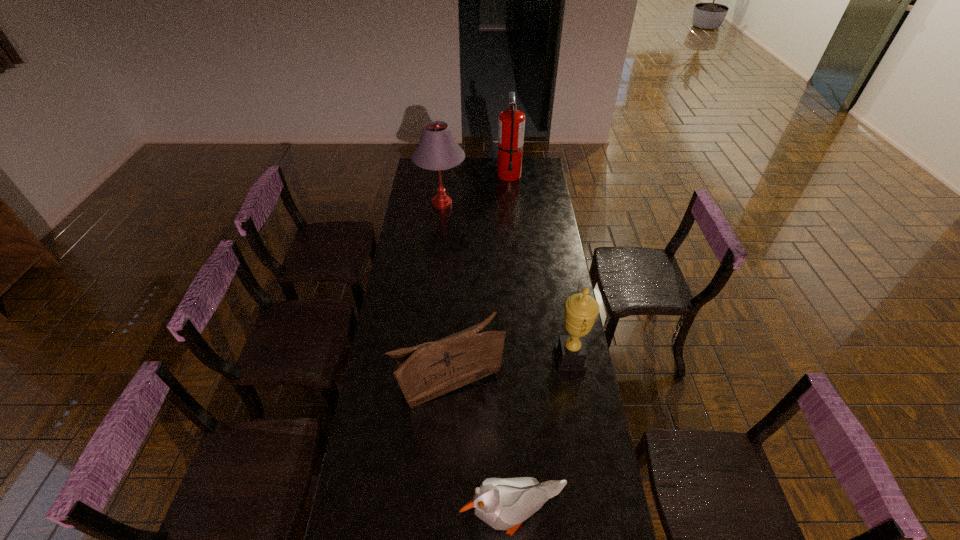
The image size is (960, 540). I want to click on the farthest object, so click(x=511, y=125).

The height and width of the screenshot is (540, 960). In order to click on table lamp in this screenshot , I will do `click(437, 149)`.

Find the location of a particular element. grocery bag is located at coordinates (426, 371).

Image resolution: width=960 pixels, height=540 pixels. What are the coordinates of `trophy cup` in the screenshot? It's located at (581, 310).

The height and width of the screenshot is (540, 960). I want to click on vacant space situated at the nozzle of the farthest object, so click(x=512, y=208).

Locate an element on the screen. free location located on the front-facing side of the second farthest object is located at coordinates (436, 258).

Where is `free space located 0.340m on the back of the grocery bag`? The width and height of the screenshot is (960, 540). free space located 0.340m on the back of the grocery bag is located at coordinates (454, 282).

You are a GUI agent. You are given a task and a screenshot of the screen. Output one action in this format:
    pyautogui.click(x=<x>, y=<y>)
    Task: Click on the vacant position located at the front of the rightmost object with handles
    The height and width of the screenshot is (540, 960).
    Given the screenshot: What is the action you would take?
    pyautogui.click(x=519, y=358)

Image resolution: width=960 pixels, height=540 pixels. I want to click on free space located at the front of the rightmost object with handles, so click(x=535, y=358).

Locate an element on the screen. vacant space located 0.190m at the front of the rightmost object with handles is located at coordinates (507, 358).